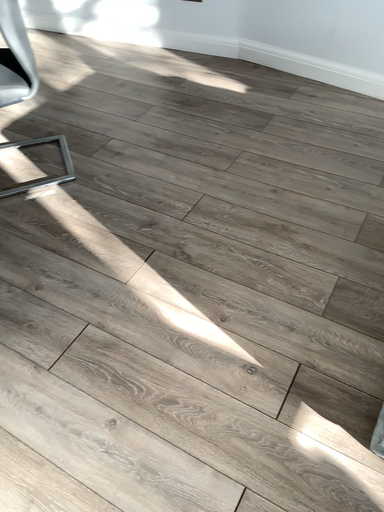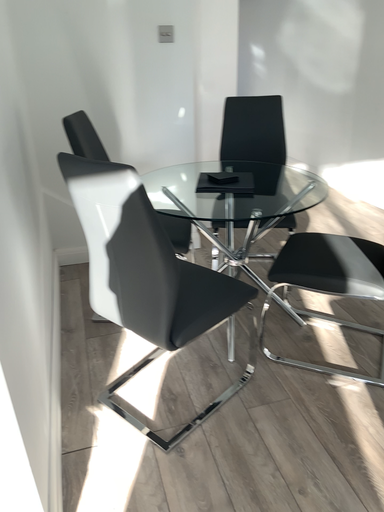
Question: How did the camera likely rotate when shooting the video?

Choices:
 (A) rotated left
 (B) rotated right

Answer: (A)